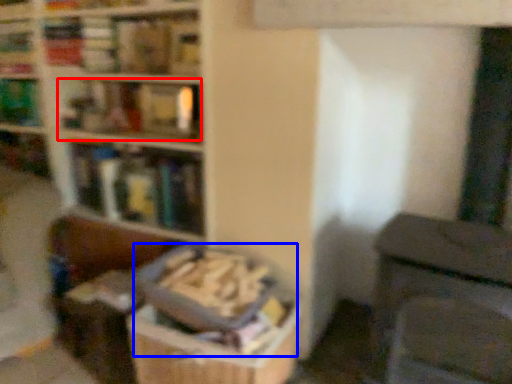
Question: Which of the following is the farthest to the observer, book (highlighted by a red box) or book (highlighted by a blue box)?

Choices:
 (A) book
 (B) book

Answer: (A)